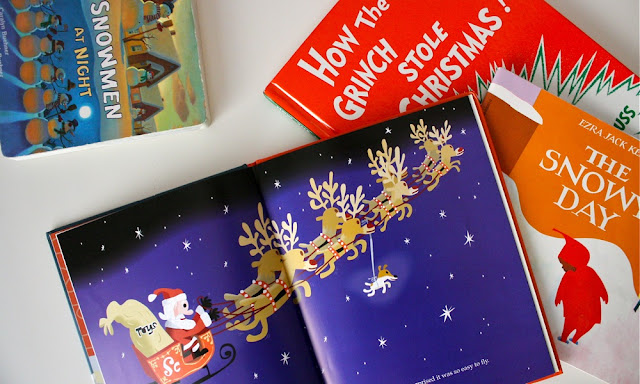
The height and width of the screenshot is (384, 640). In order to click on table in this screenshot , I will do pos(90,170).